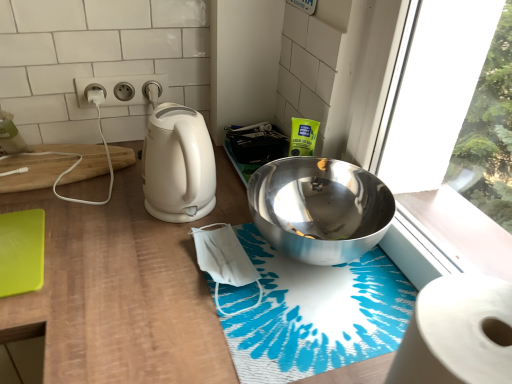
Question: Does white glossy electric kettle at left have a larger size compared to blue printed bath mat at center?

Choices:
 (A) no
 (B) yes

Answer: (B)

Question: Is white glossy electric kettle at left next to blue printed bath mat at center and touching it?

Choices:
 (A) no
 (B) yes

Answer: (A)

Question: Is white glossy electric kettle at left not close to blue printed bath mat at center?

Choices:
 (A) yes
 (B) no

Answer: (B)

Question: Is white glossy electric kettle at left facing away from blue printed bath mat at center?

Choices:
 (A) yes
 (B) no

Answer: (B)

Question: Does white glossy electric kettle at left lie behind blue printed bath mat at center?

Choices:
 (A) yes
 (B) no

Answer: (A)

Question: Which is correct: wooden at left is inside blue printed bath mat at center, or outside of it?

Choices:
 (A) outside
 (B) inside

Answer: (A)

Question: Visually, is wooden at left positioned to the left or to the right of blue printed bath mat at center?

Choices:
 (A) left
 (B) right

Answer: (A)

Question: Looking at the image, does wooden at left seem bigger or smaller compared to blue printed bath mat at center?

Choices:
 (A) small
 (B) big

Answer: (B)

Question: Is wooden at left wider or thinner than blue printed bath mat at center?

Choices:
 (A) wide
 (B) thin

Answer: (A)

Question: Relative to white matte toilet paper at left, is white glossy electric kettle at left in front or behind?

Choices:
 (A) behind
 (B) front

Answer: (B)

Question: Is white glossy electric kettle at left spatially inside white matte toilet paper at left, or outside of it?

Choices:
 (A) inside
 (B) outside

Answer: (B)

Question: Considering the positions of white glossy electric kettle at left and white matte toilet paper at left in the image, is white glossy electric kettle at left taller or shorter than white matte toilet paper at left?

Choices:
 (A) tall
 (B) short

Answer: (A)

Question: Does point (205, 155) appear closer or farther from the camera than point (10, 142)?

Choices:
 (A) closer
 (B) farther

Answer: (A)

Question: Based on their positions, is silver metallic bowl at upper right located to the left or right of white plastic electrical outlet at upper center?

Choices:
 (A) right
 (B) left

Answer: (A)

Question: Considering the positions of point (354, 210) and point (105, 91), is point (354, 210) closer or farther from the camera than point (105, 91)?

Choices:
 (A) farther
 (B) closer

Answer: (B)